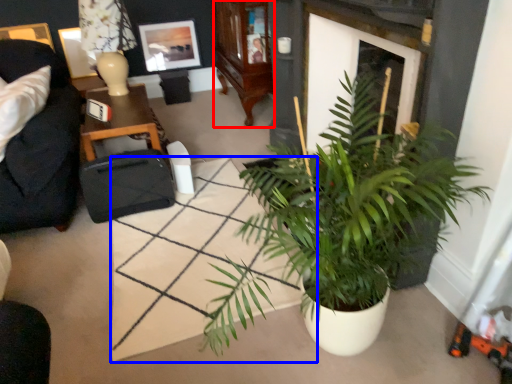
Question: Which object appears closest to the camera in this image, cabinetry (highlighted by a red box) or square (highlighted by a blue box)?

Choices:
 (A) cabinetry
 (B) square

Answer: (B)